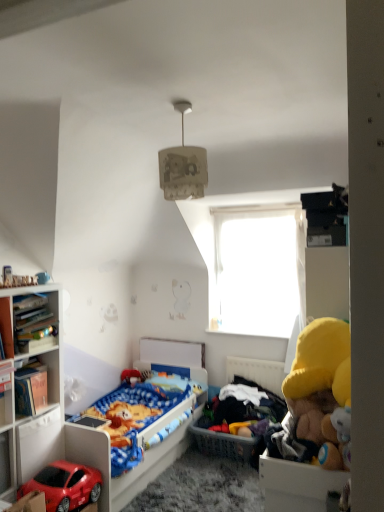
Question: Is matte white bookcase at left in front of shiny red toy car at lower left?

Choices:
 (A) yes
 (B) no

Answer: (B)

Question: Does matte white bookcase at left turn towards shiny red toy car at lower left?

Choices:
 (A) no
 (B) yes

Answer: (B)

Question: From a real-world perspective, does matte white bookcase at left sit lower than shiny red toy car at lower left?

Choices:
 (A) yes
 (B) no

Answer: (B)

Question: Is shiny red toy car at lower left located within matte white bookcase at left?

Choices:
 (A) no
 (B) yes

Answer: (A)

Question: Is the depth of matte white bookcase at left greater than that of shiny red toy car at lower left?

Choices:
 (A) no
 (B) yes

Answer: (B)

Question: Can you confirm if matte white bookcase at left is thinner than shiny red toy car at lower left?

Choices:
 (A) yes
 (B) no

Answer: (B)

Question: Is matte white bookshelf at left, arranged as the first cabinet when viewed from the back, located within shiny red toy car at lower left?

Choices:
 (A) yes
 (B) no

Answer: (B)

Question: From the image's perspective, is shiny red toy car at lower left under matte white bookshelf at left, positioned as the 1th cabinet in left-to-right order?

Choices:
 (A) no
 (B) yes

Answer: (B)

Question: Is shiny red toy car at lower left to the left of matte white bookshelf at left, arranged as the first cabinet when viewed from the back, from the viewer's perspective?

Choices:
 (A) no
 (B) yes

Answer: (A)

Question: Is shiny red toy car at lower left oriented towards matte white bookshelf at left, positioned as the 1th cabinet in left-to-right order?

Choices:
 (A) yes
 (B) no

Answer: (B)

Question: Considering the relative sizes of shiny red toy car at lower left and matte white bookshelf at left, the 3th cabinet viewed from the front, in the image provided, is shiny red toy car at lower left taller than matte white bookshelf at left, the 3th cabinet viewed from the front,?

Choices:
 (A) yes
 (B) no

Answer: (B)

Question: Considering the relative sizes of shiny red toy car at lower left and matte white bookshelf at left, positioned as the 1th cabinet in left-to-right order, in the image provided, is shiny red toy car at lower left smaller than matte white bookshelf at left, positioned as the 1th cabinet in left-to-right order,?

Choices:
 (A) yes
 (B) no

Answer: (B)

Question: From the image's perspective, is wooden bookshelf at left, the second cabinet when ordered from left to right, beneath matte plastic bed at lower left?

Choices:
 (A) no
 (B) yes

Answer: (A)